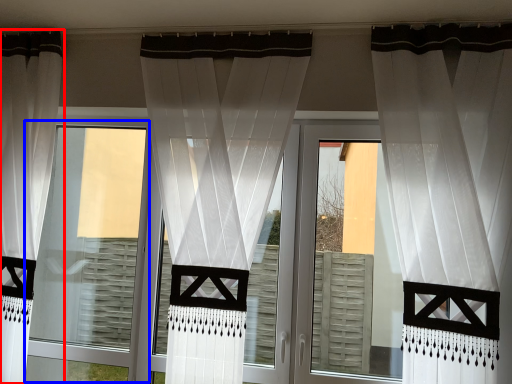
Question: Which object is further to the camera taking this photo, curtain (highlighted by a red box) or window frame (highlighted by a blue box)?

Choices:
 (A) curtain
 (B) window frame

Answer: (B)